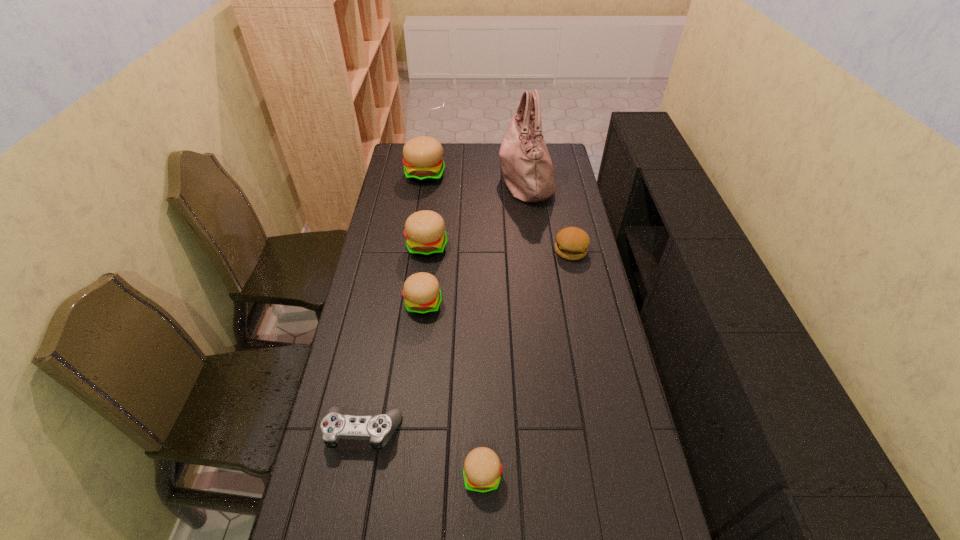
In order to click on blank area located 0.170m on the front of the sixth farthest object in this screenshot , I will do `click(345, 528)`.

This screenshot has height=540, width=960. I want to click on handbag situated at the far edge, so point(527,168).

The width and height of the screenshot is (960, 540). I want to click on hamburger present at the far edge, so click(x=423, y=163).

Image resolution: width=960 pixels, height=540 pixels. Find the location of `control located at the left edge`. control located at the left edge is located at coordinates (378, 429).

Locate an element on the screen. The width and height of the screenshot is (960, 540). handbag at the right edge is located at coordinates (527, 168).

Locate an element on the screen. hamburger positioned at the right edge is located at coordinates (572, 243).

Identify the location of object that is positioned at the far left corner. The width and height of the screenshot is (960, 540). pyautogui.click(x=423, y=163).

At what (x,y) coordinates should I click in order to perform the action: click on object at the far right corner. Please return your answer as a coordinate pair (x, y). Looking at the image, I should click on (527, 168).

Where is `free space at the far edge of the desktop`? The image size is (960, 540). free space at the far edge of the desktop is located at coordinates (492, 146).

Where is `vacant space at the left edge of the desktop`? This screenshot has height=540, width=960. vacant space at the left edge of the desktop is located at coordinates (381, 248).